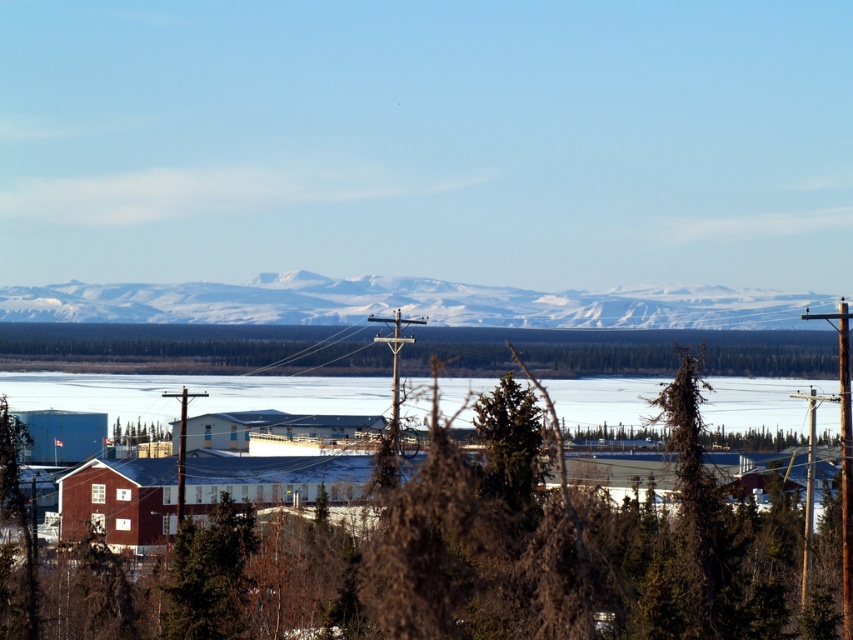
Based on the photo, you are standing in the winter landscape and want to identify the tree located at the center of the image. According to the provided coordinates, which tree is positioned at point (511, 548)?

The point at coordinates (511, 548) indicates a brown textured tree at center.

You are standing in the winter landscape and want to walk from the point at coordinates point [381,480] to the point at coordinates point [334,323]. Which direction should you face to move towards the second point?

Point [381,480] is in front of point [334,323], so you should face away from the mountains to move towards point [334,323].